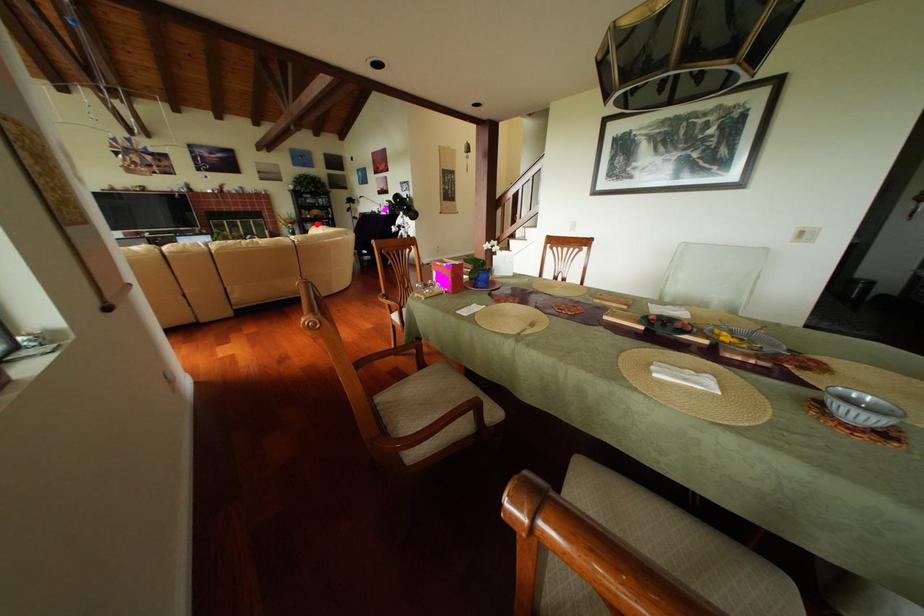
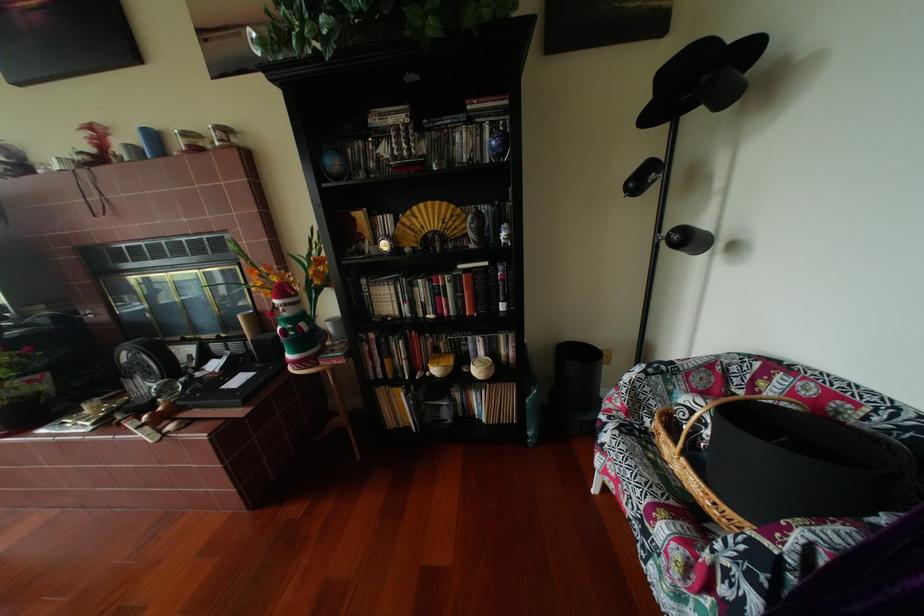
In the second image, find the point that corresponds to the highlighted location in the first image.

(377, 283)